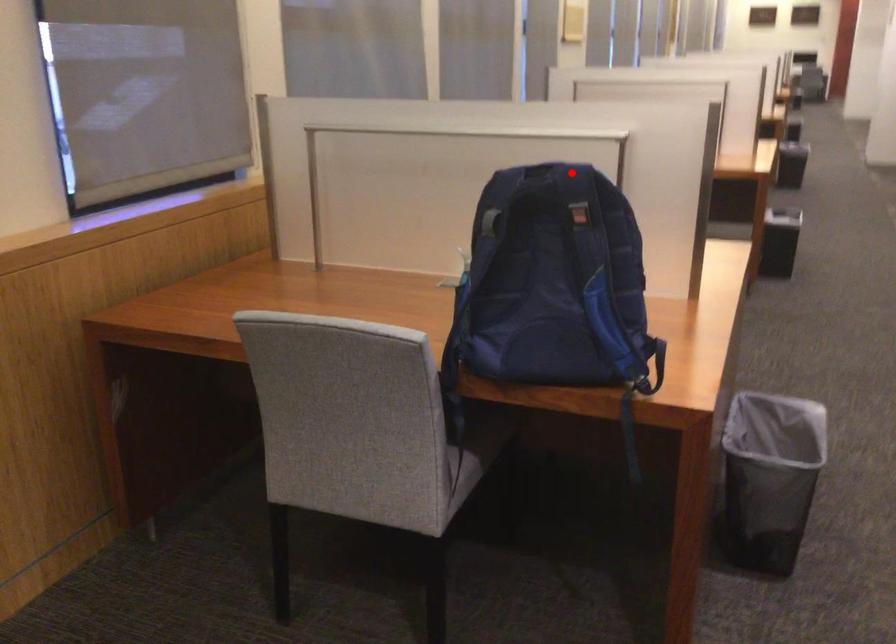
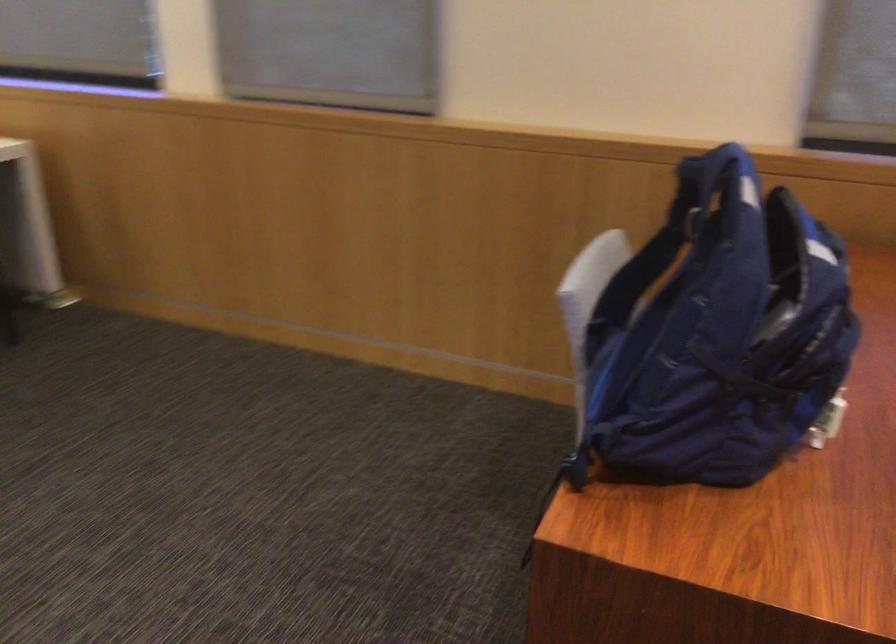
Question: A red point is marked in image1. In image2, is the corresponding 3D point closer to the camera or farther? Reply with the corresponding letter.

Choices:
 (A) The corresponding 3D point is closer.
 (B) The corresponding 3D point is farther.

Answer: (A)